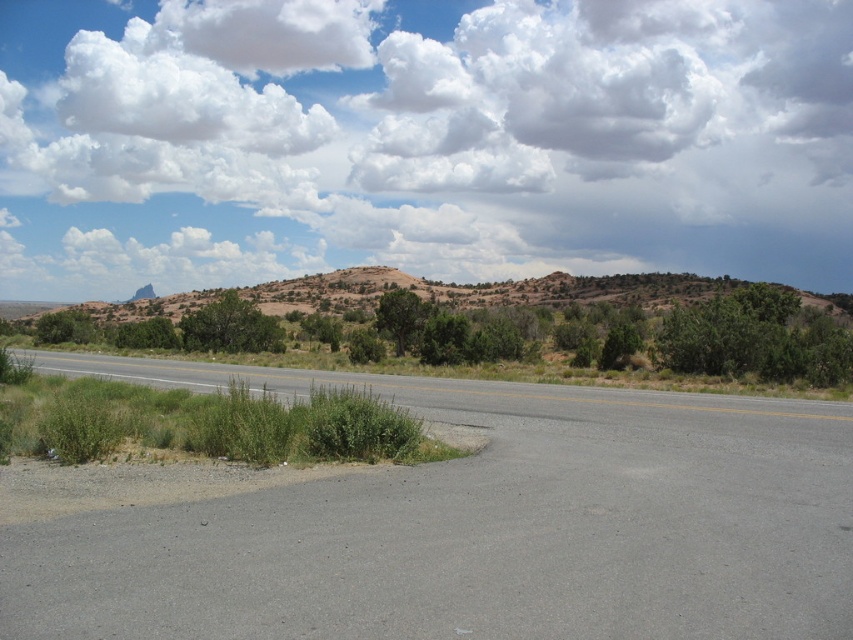
Does point (328, 13) lie behind point (837, 387)?

Yes, it is.

Is point (154, 6) positioned before point (730, 378)?

No, it is not.

Locate an element on the screen. The width and height of the screenshot is (853, 640). white fluffy cloud at upper center is located at coordinates (421, 140).

Between point (207, 624) and point (271, 312), which one is positioned in front?

Point (207, 624) is more forward.

Does point (715, 484) lie in front of point (154, 300)?

Yes, point (715, 484) is in front of point (154, 300).

Locate an element on the screen. gray asphalt highway at center is located at coordinates (476, 525).

Does point (177, 234) come in front of point (439, 609)?

No, it is not.

Can you confirm if white fluffy cloud at upper center is wider than gray asphalt highway at center?

Correct, the width of white fluffy cloud at upper center exceeds that of gray asphalt highway at center.

Which is behind, point (84, 64) or point (795, 412)?

Positioned behind is point (84, 64).

Locate an element on the screen. white fluffy cloud at upper center is located at coordinates (421, 140).